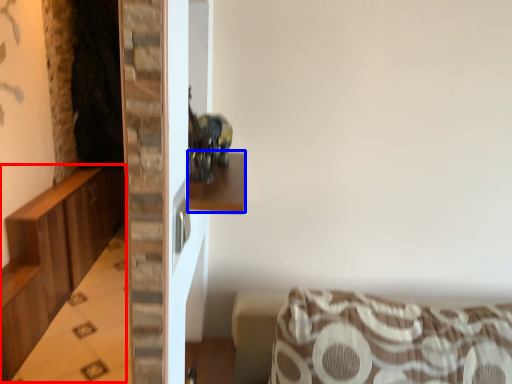
Question: Which of the following is the farthest to the observer, dresser (highlighted by a red box) or shelf (highlighted by a blue box)?

Choices:
 (A) dresser
 (B) shelf

Answer: (A)